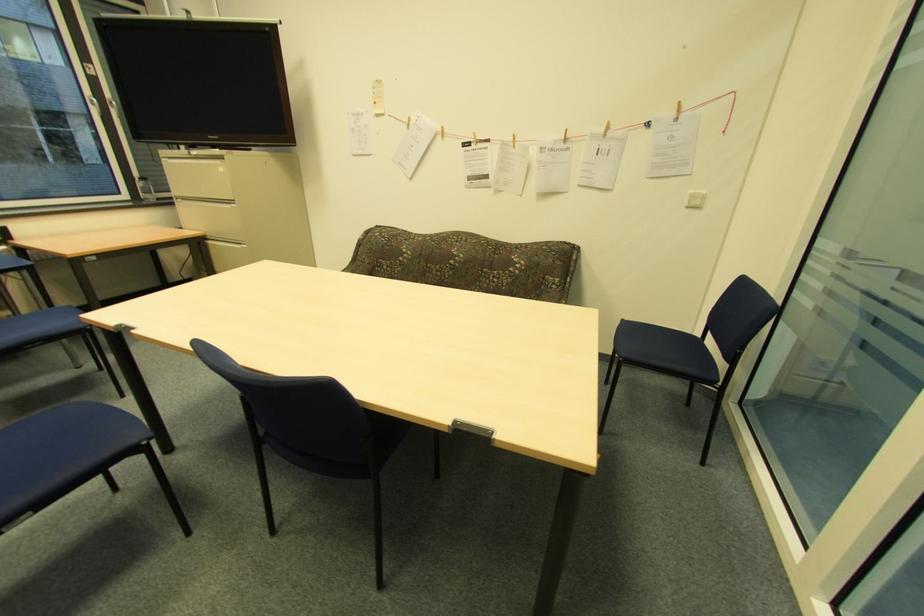
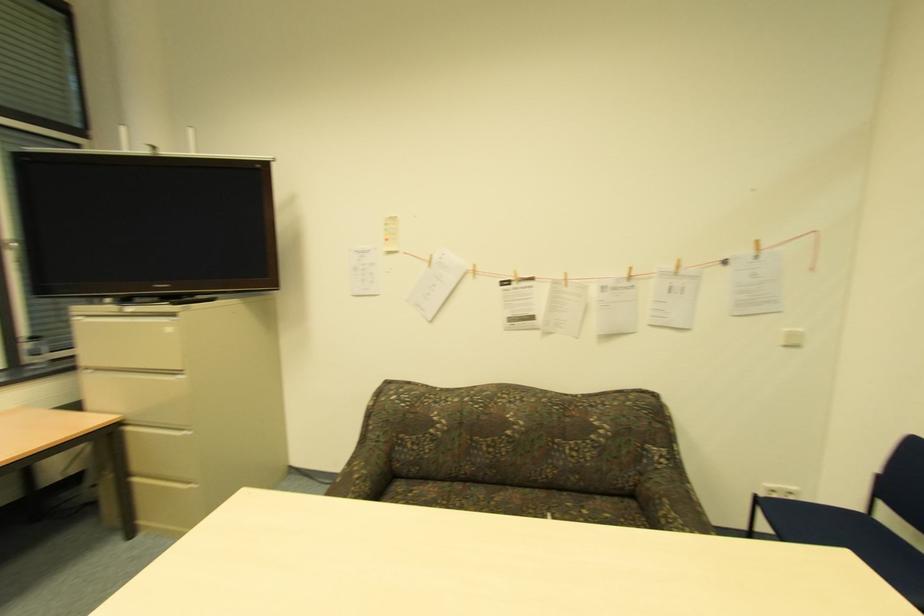
In the second image, find the point that corresponds to the point at 181,200 in the first image.

(91, 370)